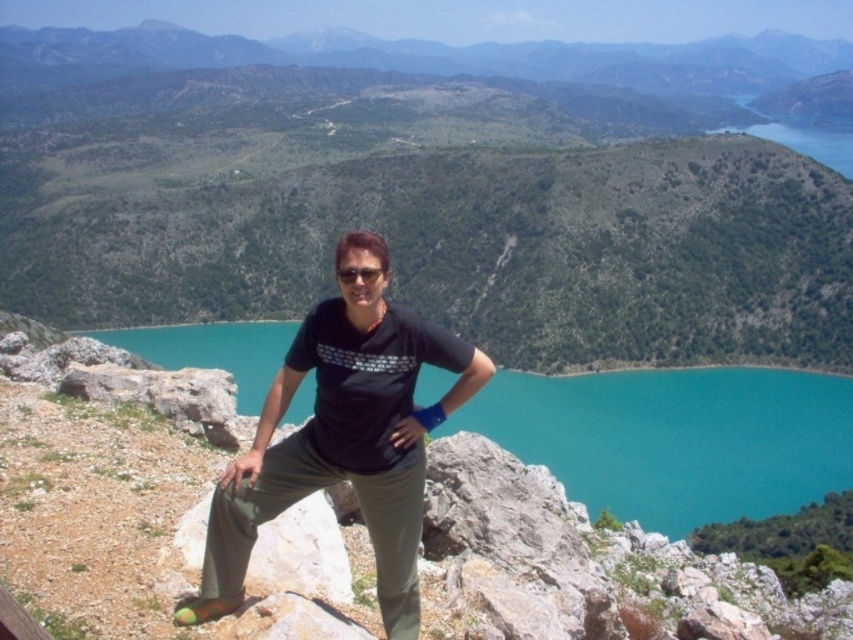
Question: Which object appears farthest from the camera in this image?

Choices:
 (A) matte black t-shirt at center
 (B) turquoise glossy water at center

Answer: (B)

Question: Is turquoise glossy water at center to the right of matte black t-shirt at center from the viewer's perspective?

Choices:
 (A) no
 (B) yes

Answer: (A)

Question: Does turquoise glossy water at center appear on the right side of matte black t-shirt at center?

Choices:
 (A) yes
 (B) no

Answer: (B)

Question: Can you confirm if turquoise glossy water at center is positioned below matte black t-shirt at center?

Choices:
 (A) no
 (B) yes

Answer: (B)

Question: Which point is farther to the camera?

Choices:
 (A) (393, 499)
 (B) (704, 508)

Answer: (B)